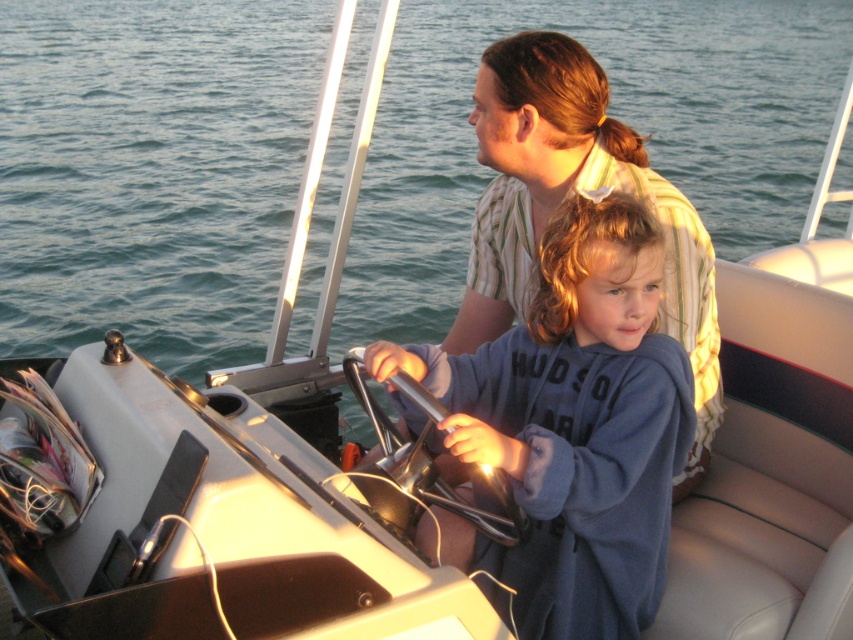
You are on a boat and need to hand a life jacket to the person wearing the blue fleece jacket at center. Since you are standing behind the matte striped shirt at center, can you reach them directly without moving around?

The blue fleece jacket at center is in front of the matte striped shirt at center, so you can reach them directly without moving around.

You are a passenger on the motorboat and need to determine which clothing item belongs to the child. The blue fleece jacket at center and the matte striped shirt at center are both visible. Based on their sizes, which one is more likely to belong to the child?

The blue fleece jacket at center is smaller than the matte striped shirt at center, so it is more likely to belong to the child.

You are a passenger on the boat and need to hand a life jacket to the person wearing the blue fleece jacket at center. Which direction should you move to reach them, considering their position relative to the matte striped shirt at center?

The blue fleece jacket at center is located below the matte striped shirt at center, so you should move downward to reach the person wearing the blue fleece jacket at center.